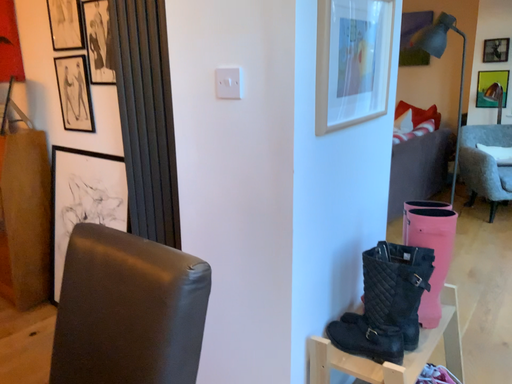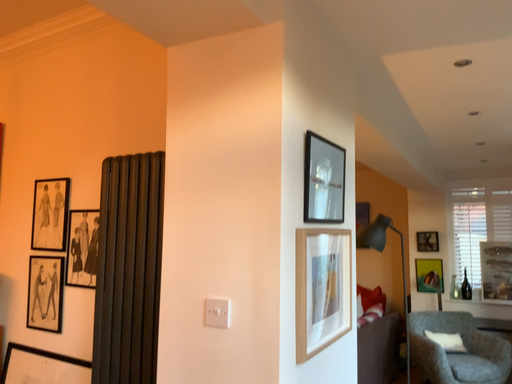
Question: Which way did the camera rotate in the video?

Choices:
 (A) rotated left
 (B) rotated right

Answer: (B)